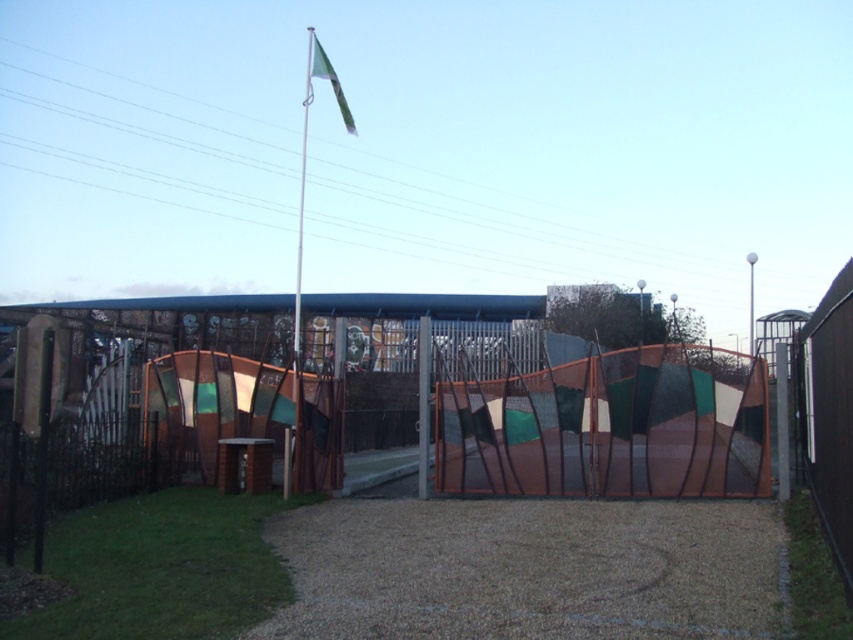
Question: Estimate the real-world distances between objects in this image. Which object is closer to the green fabric flag at upper center?

Choices:
 (A) textured brown fence at center
 (B) brown textured fence at right
 (C) white metallic flag pole at center

Answer: (C)

Question: Which point appears farthest from the camera in this image?

Choices:
 (A) (347, 116)
 (B) (705, 406)
 (C) (809, 340)

Answer: (A)

Question: Is brown textured fence at right further to the viewer compared to white metallic flag pole at center?

Choices:
 (A) no
 (B) yes

Answer: (A)

Question: Which object is closer to the camera taking this photo?

Choices:
 (A) green fabric flag at upper center
 (B) white metallic flag pole at center
 (C) brown textured fence at right
 (D) textured brown fence at center

Answer: (C)

Question: Can you confirm if white metallic flag pole at center is positioned to the right of green fabric flag at upper center?

Choices:
 (A) yes
 (B) no

Answer: (B)

Question: Is white metallic flag pole at center smaller than green fabric flag at upper center?

Choices:
 (A) yes
 (B) no

Answer: (B)